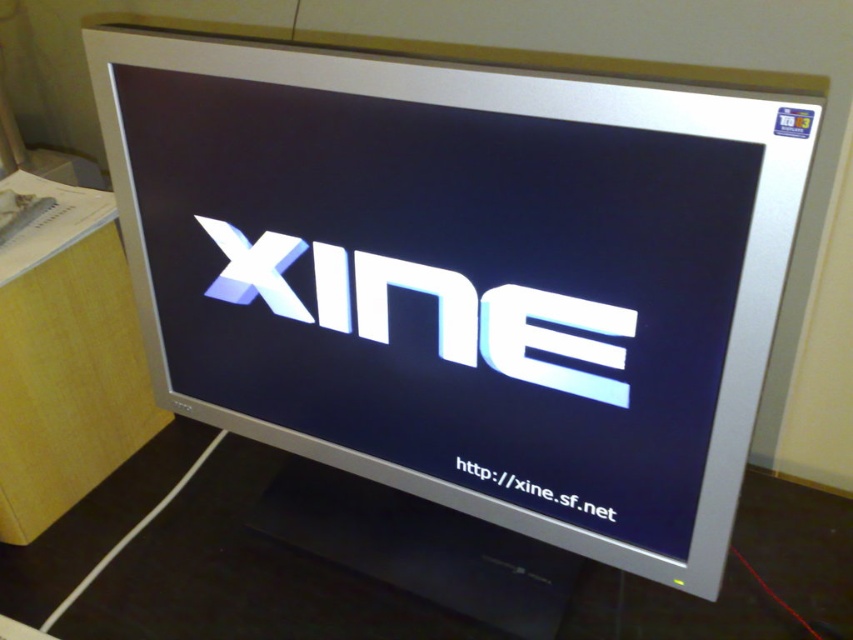
Question: Is yellow wood table at left above white glossy text at center?

Choices:
 (A) no
 (B) yes

Answer: (B)

Question: Which point is farther to the camera?

Choices:
 (A) white glossy text at center
 (B) shiny metallic xine at center

Answer: (A)

Question: Does yellow wood table at left have a greater width compared to shiny metallic xine at center?

Choices:
 (A) yes
 (B) no

Answer: (B)

Question: Which is nearer to the white glossy text at center?

Choices:
 (A) shiny metallic xine at center
 (B) yellow wood table at left

Answer: (A)

Question: Which of the following is the farthest from the observer?

Choices:
 (A) shiny metallic xine at center
 (B) white glossy text at center
 (C) yellow wood table at left

Answer: (C)

Question: Observing the image, what is the correct spatial positioning of yellow wood table at left in reference to white glossy text at center?

Choices:
 (A) below
 (B) above

Answer: (B)